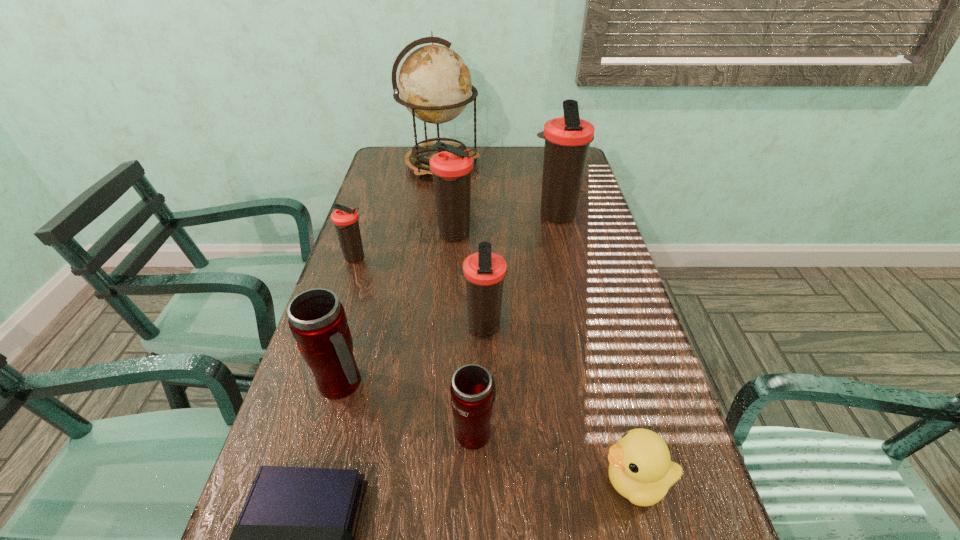
The width and height of the screenshot is (960, 540). I want to click on the nearest thermos bottle, so click(x=473, y=390).

Where is `the right red thermos bottle`? The image size is (960, 540). the right red thermos bottle is located at coordinates (473, 390).

The image size is (960, 540). I want to click on the third farthest brown thermos bottle, so click(345, 219).

Where is `the fourth nearest thermos bottle`? The image size is (960, 540). the fourth nearest thermos bottle is located at coordinates (345, 219).

Image resolution: width=960 pixels, height=540 pixels. Find the location of `yellow duck`. yellow duck is located at coordinates (641, 470).

The image size is (960, 540). In order to click on the second shortest object in this screenshot , I will do `click(641, 470)`.

The width and height of the screenshot is (960, 540). In order to click on vacant space located at the center of the tallest object in this screenshot , I will do `click(498, 165)`.

Where is `free space located 0.300m on the front of the rightmost brown thermos bottle`? free space located 0.300m on the front of the rightmost brown thermos bottle is located at coordinates (573, 296).

This screenshot has height=540, width=960. I want to click on vacant space situated 0.190m on the left of the fifth shortest thermos bottle, so click(x=373, y=235).

Identify the location of vacant space located on the front of the third nearest thermos bottle. (482, 426).